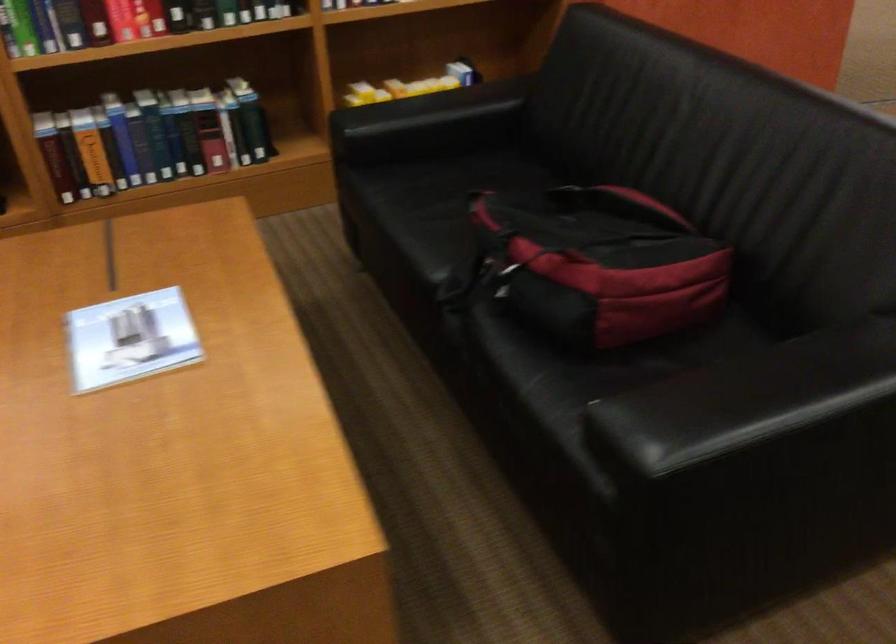
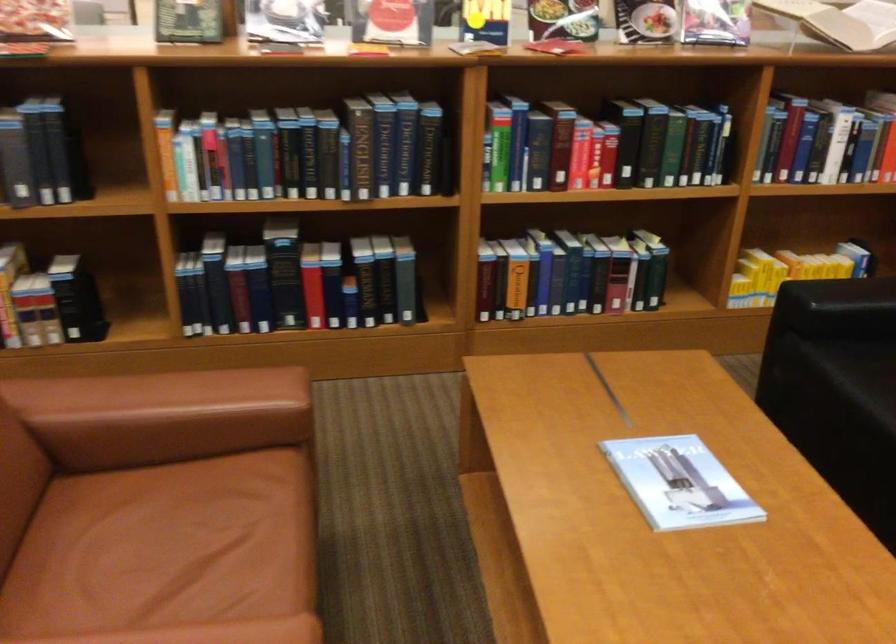
The point at (x=150, y=136) is marked in the first image. Where is the corresponding point in the second image?

(569, 275)